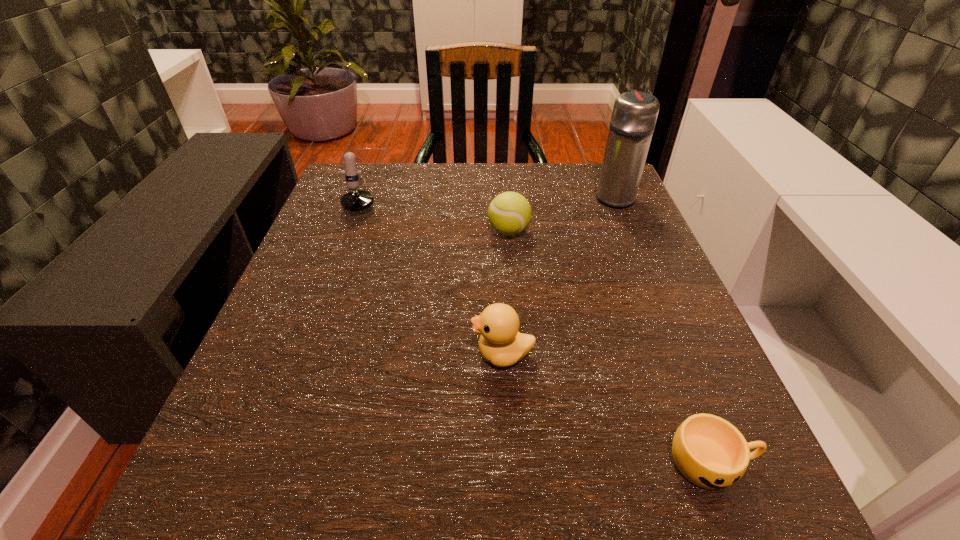
Where is `free space between the leftmost object and the third farthest object`? free space between the leftmost object and the third farthest object is located at coordinates (436, 214).

Where is `blank region between the cup and the tallest object`? The image size is (960, 540). blank region between the cup and the tallest object is located at coordinates (663, 329).

This screenshot has height=540, width=960. I want to click on free space between the cup and the tennis ball, so click(611, 347).

This screenshot has height=540, width=960. Identify the location of vacant area between the thermos bottle and the second nearest object. (559, 275).

The height and width of the screenshot is (540, 960). Identify the location of vacant space in between the duck and the leftmost object. (433, 275).

This screenshot has width=960, height=540. I want to click on vacant area between the microphone and the fourth farthest object, so click(x=433, y=275).

Find the location of a particular element. The image size is (960, 540). vacant space that is in between the tennis ball and the tallest object is located at coordinates (562, 213).

In order to click on vacant point located between the fourth farthest object and the thermos bottle in this screenshot , I will do `click(559, 275)`.

You are a GUI agent. You are given a task and a screenshot of the screen. Output one action in this format:
    pyautogui.click(x=<x>, y=<y>)
    Task: Click on the empty space that is in between the duck and the leftmost object
    This screenshot has width=960, height=540.
    Given the screenshot: What is the action you would take?
    pyautogui.click(x=433, y=275)

Find the location of a particular element. This screenshot has height=540, width=960. object that ranks as the fourth closest to the fourth shortest object is located at coordinates (710, 452).